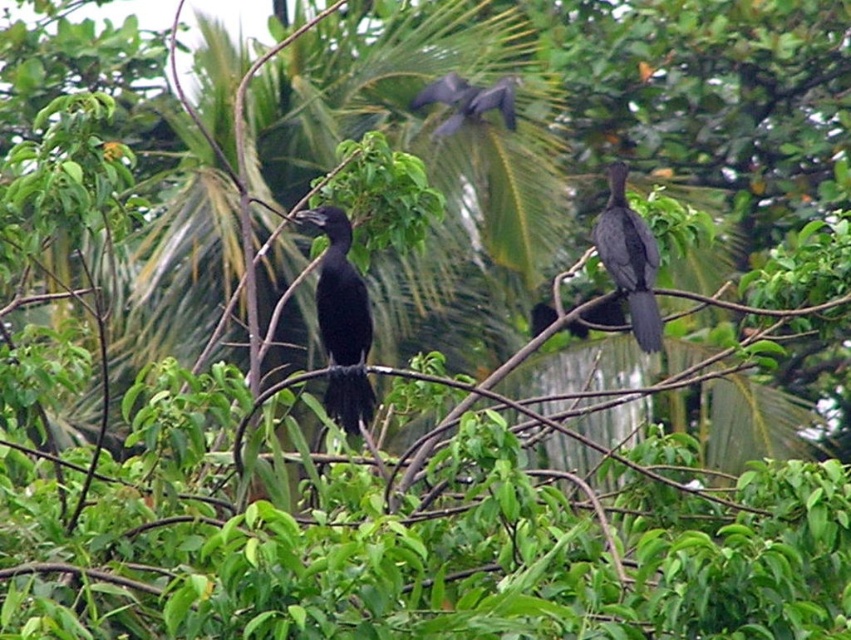
Question: Does black matte bird at center appear over shiny black bird at upper center?

Choices:
 (A) no
 (B) yes

Answer: (A)

Question: Does black matte bird at center lie behind shiny black bird at upper center?

Choices:
 (A) yes
 (B) no

Answer: (B)

Question: Can you confirm if shiny black bird at right is positioned to the right of shiny black bird at upper center?

Choices:
 (A) no
 (B) yes

Answer: (B)

Question: Which point appears closest to the camera in this image?

Choices:
 (A) (606, 256)
 (B) (355, 388)
 (C) (463, 84)

Answer: (B)

Question: Among these points, which one is farthest from the camera?

Choices:
 (A) (318, 326)
 (B) (443, 77)

Answer: (B)

Question: Which point is farther to the camera?

Choices:
 (A) shiny black bird at upper center
 (B) black matte bird at center

Answer: (A)